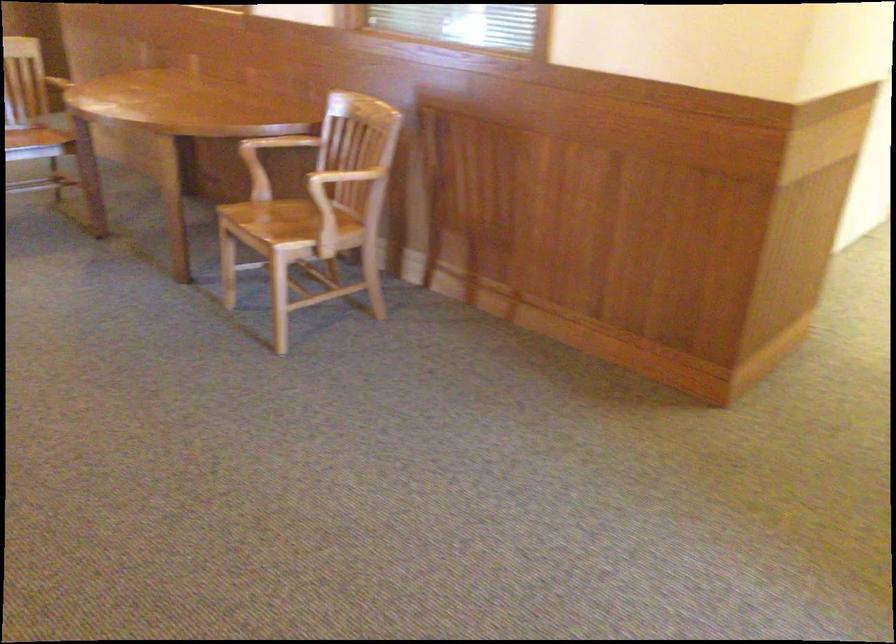
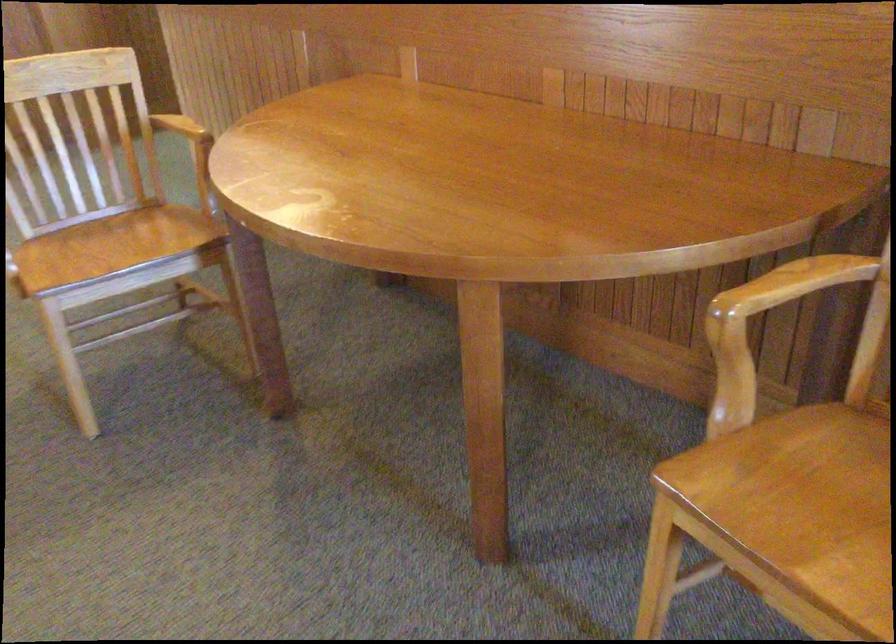
What movement of the cameraman would produce the second image?

The cameraman walked toward left, forward.